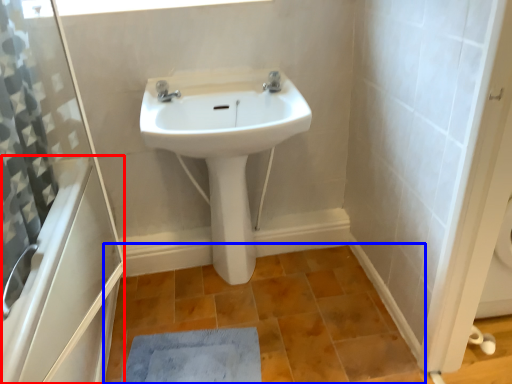
Question: Which point is further to the camera, bath (highlighted by a red box) or ceramic tile (highlighted by a blue box)?

Choices:
 (A) bath
 (B) ceramic tile

Answer: (B)